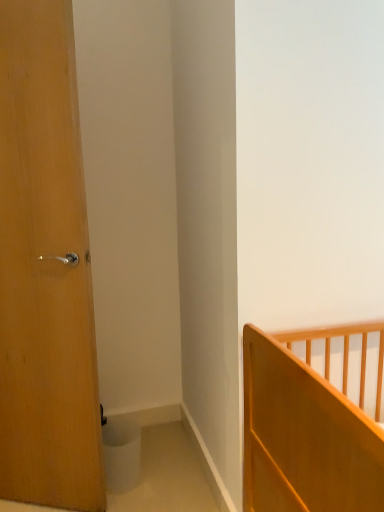
Question: Does light wood door at left have a larger size compared to light brown wooden bed at lower right?

Choices:
 (A) yes
 (B) no

Answer: (B)

Question: Is light brown wooden bed at lower right inside light wood door at left?

Choices:
 (A) yes
 (B) no

Answer: (B)

Question: Is light wood door at left taller than light brown wooden bed at lower right?

Choices:
 (A) no
 (B) yes

Answer: (B)

Question: Is light wood door at left in contact with light brown wooden bed at lower right?

Choices:
 (A) no
 (B) yes

Answer: (A)

Question: Is light wood door at left at the left side of light brown wooden bed at lower right?

Choices:
 (A) yes
 (B) no

Answer: (A)

Question: Is light wood door at left aimed at light brown wooden bed at lower right?

Choices:
 (A) no
 (B) yes

Answer: (A)

Question: Can you confirm if light brown wooden bed at lower right is wider than light wood door at left?

Choices:
 (A) no
 (B) yes

Answer: (B)

Question: Considering the relative positions of light brown wooden bed at lower right and light wood door at left in the image provided, is light brown wooden bed at lower right to the left of light wood door at left from the viewer's perspective?

Choices:
 (A) no
 (B) yes

Answer: (A)

Question: Is the position of light brown wooden bed at lower right more distant than that of light wood door at left?

Choices:
 (A) yes
 (B) no

Answer: (B)

Question: Is light brown wooden bed at lower right touching light wood door at left?

Choices:
 (A) no
 (B) yes

Answer: (A)

Question: From a real-world perspective, is light brown wooden bed at lower right physically above light wood door at left?

Choices:
 (A) yes
 (B) no

Answer: (B)

Question: Is light brown wooden bed at lower right outside light wood door at left?

Choices:
 (A) yes
 (B) no

Answer: (A)

Question: Is point (324, 435) closer or farther from the camera than point (43, 36)?

Choices:
 (A) closer
 (B) farther

Answer: (A)